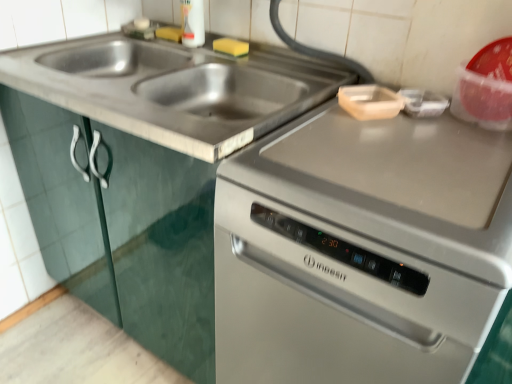
At what (x,y) coordinates should I click in order to perform the action: click on vacant space positioned to the left of wooden cutting board at upper right. Please return your answer as a coordinate pair (x, y). The image size is (512, 384). Looking at the image, I should click on (312, 117).